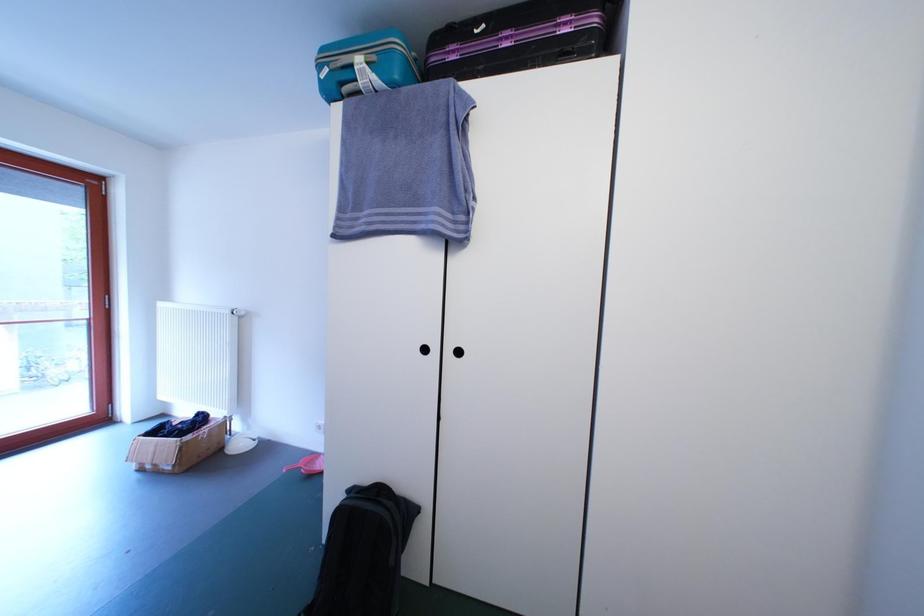
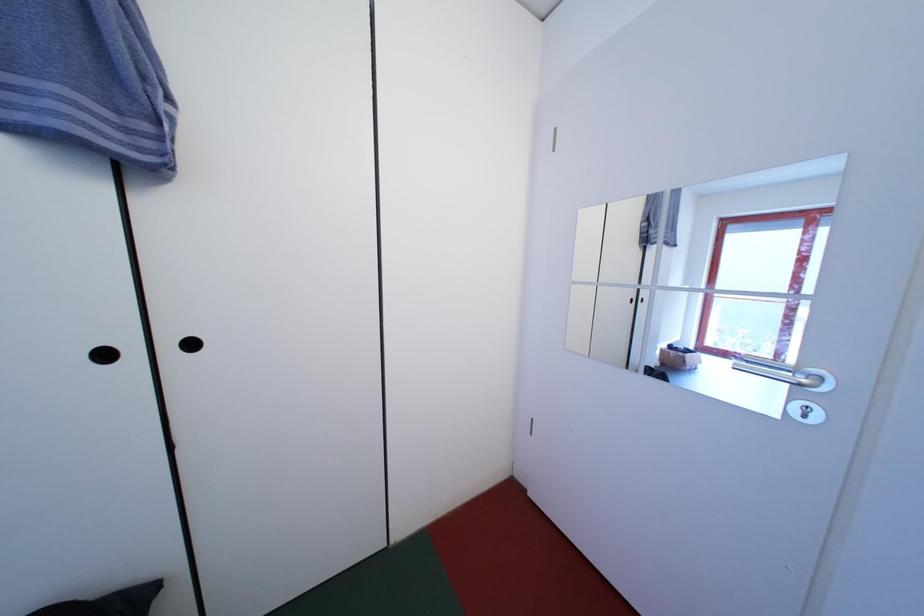
Question: The images are taken continuously from a first-person perspective. In which direction is your viewpoint rotating?

Choices:
 (A) Left
 (B) Right
 (C) Up
 (D) Down

Answer: (B)